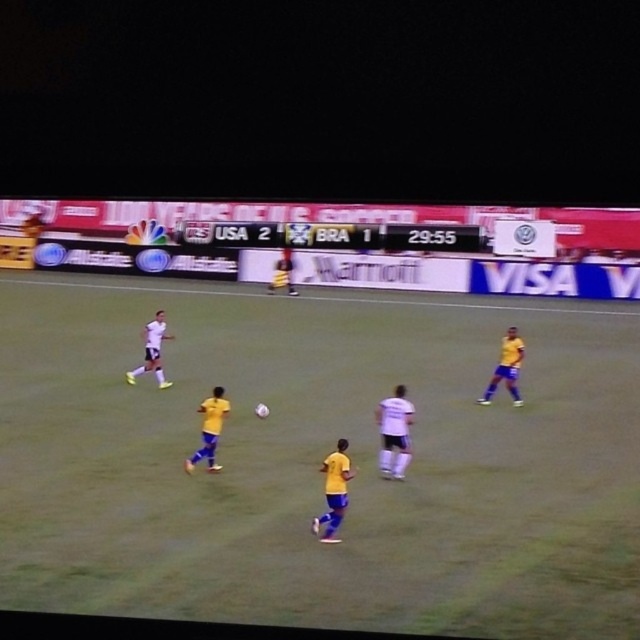
Question: Among these points, which one is farthest from the camera?

Choices:
 (A) (285, 257)
 (B) (337, 524)

Answer: (A)

Question: Does white matte jersey at center appear under yellow jersey at center?

Choices:
 (A) yes
 (B) no

Answer: (A)

Question: Which object is the farthest from the white matte soccer player at left?

Choices:
 (A) yellow jersey at center
 (B) yellow matte jersey at center

Answer: (A)

Question: Does yellow matte jersey at center have a lesser width compared to yellow jersey at center?

Choices:
 (A) yes
 (B) no

Answer: (A)

Question: Considering the real-world distances, which object is closest to the yellow matte soccer player at center?

Choices:
 (A) white matte soccer player at left
 (B) yellow jersey at center

Answer: (A)

Question: Is white matte jersey at center above yellow jersey at center?

Choices:
 (A) no
 (B) yes

Answer: (A)